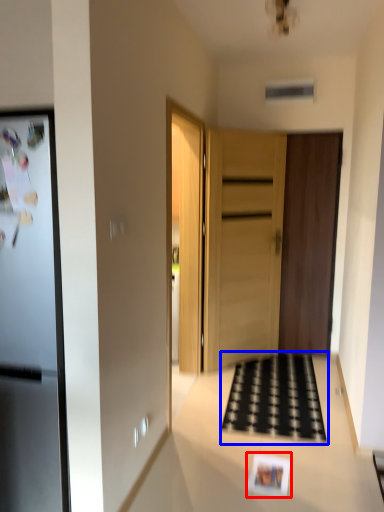
Question: Which object appears closest to the camera in this image, postcard (highlighted by a red box) or doormat (highlighted by a blue box)?

Choices:
 (A) postcard
 (B) doormat

Answer: (A)